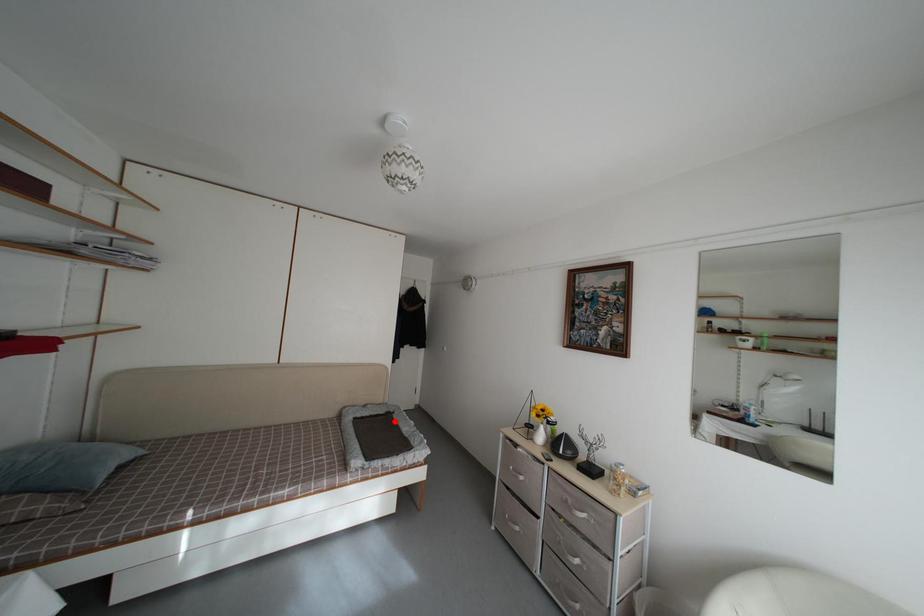
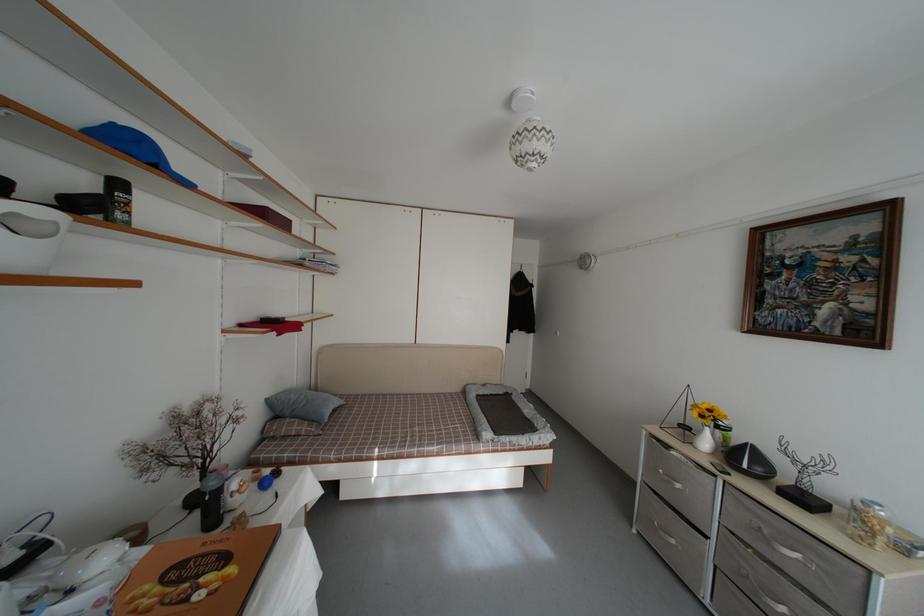
Question: I am providing you with two images of the same scene from different viewpoints. Image1 has a red point marked. In image2, the corresponding 3D location appears at what relative position? Reply with the corresponding letter.

Choices:
 (A) Closer
 (B) Farther

Answer: (B)